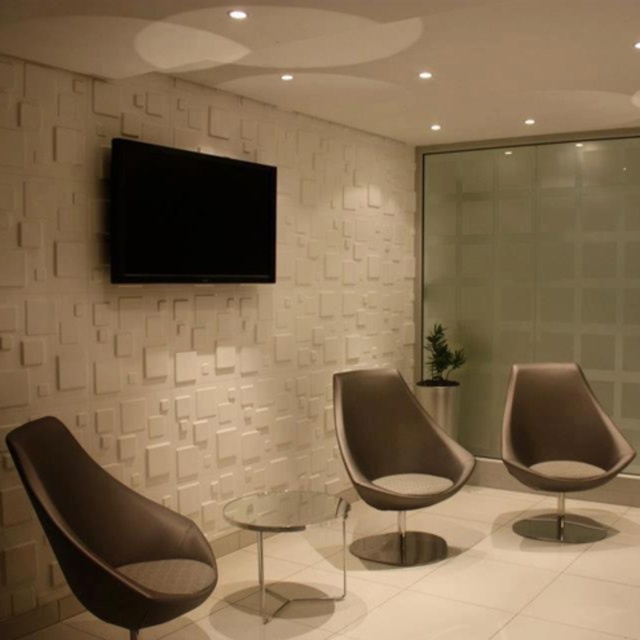
Question: Does matte black chair at lower left appear over matte brown chair at center?

Choices:
 (A) yes
 (B) no

Answer: (B)

Question: Which of the following is the closest to the observer?

Choices:
 (A) matte brown chair at center
 (B) transparent glass table at center
 (C) matte black chair at lower left
 (D) matte brown leather swivel chair at right

Answer: (C)

Question: Can you confirm if matte brown chair at center is wider than transparent glass table at center?

Choices:
 (A) yes
 (B) no

Answer: (A)

Question: Which object is the closest to the matte brown leather swivel chair at right?

Choices:
 (A) matte black chair at lower left
 (B) matte brown chair at center
 (C) transparent glass table at center

Answer: (B)

Question: Which of these objects is positioned farthest from the matte brown chair at center?

Choices:
 (A) matte brown leather swivel chair at right
 (B) matte black chair at lower left

Answer: (B)

Question: Is matte black chair at lower left smaller than matte brown chair at center?

Choices:
 (A) no
 (B) yes

Answer: (B)